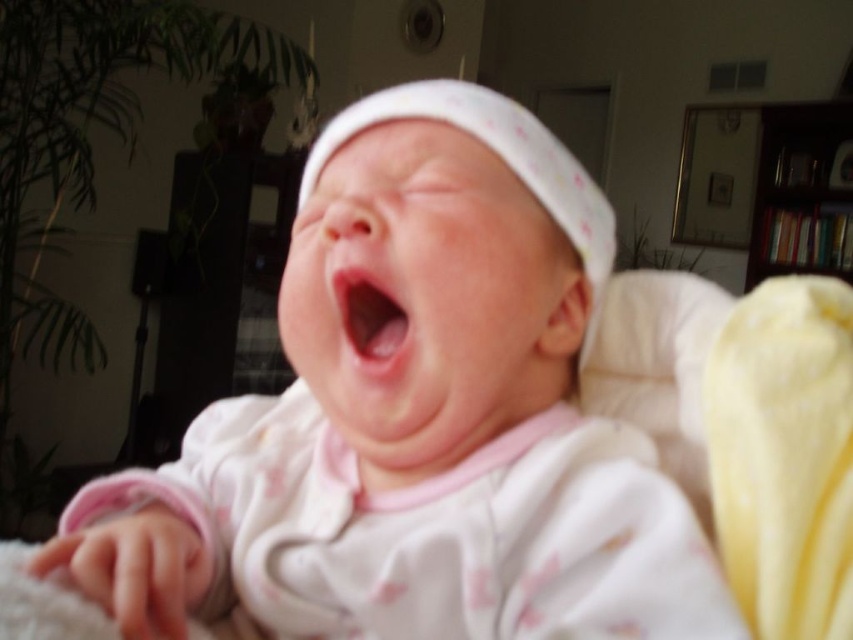
Where is the white soft baby at center located in the image?

The white soft baby at center is located at point 0.659 on the x axis and 0.490 on the y axis.